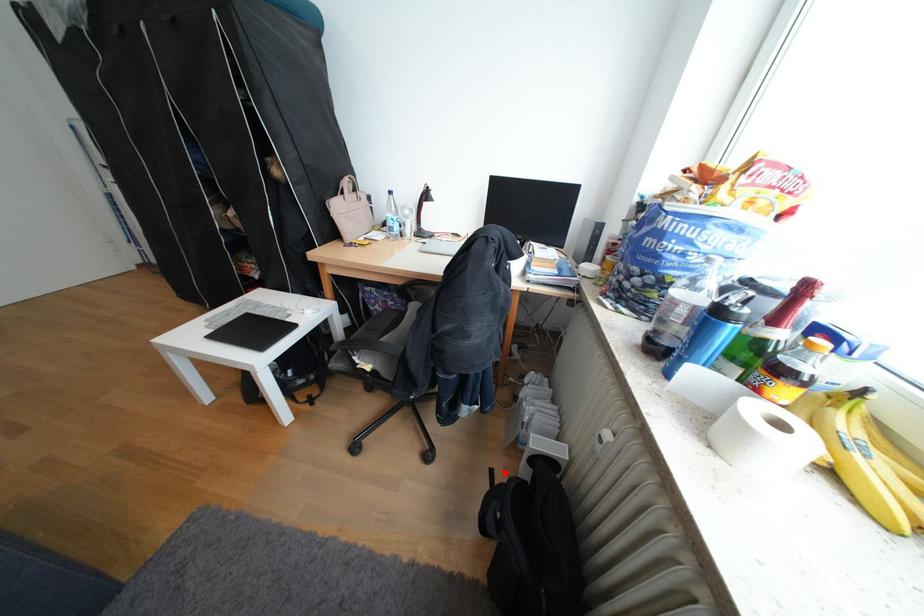
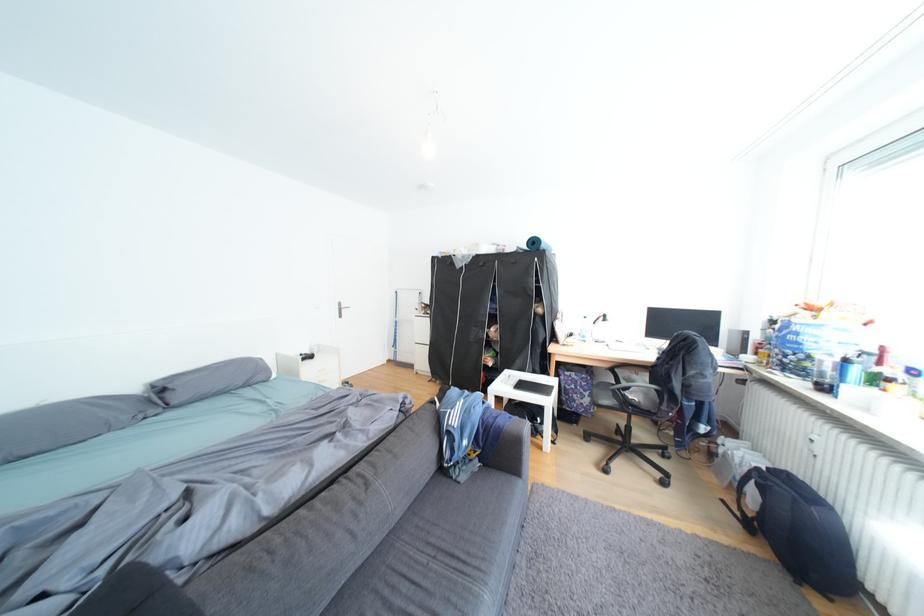
Question: I am providing you with two images of the same scene from different viewpoints. In image1, a red point is highlighted. Considering the same 3D point in image2, which of the following is correct?

Choices:
 (A) It is closer
 (B) It is farther

Answer: (B)